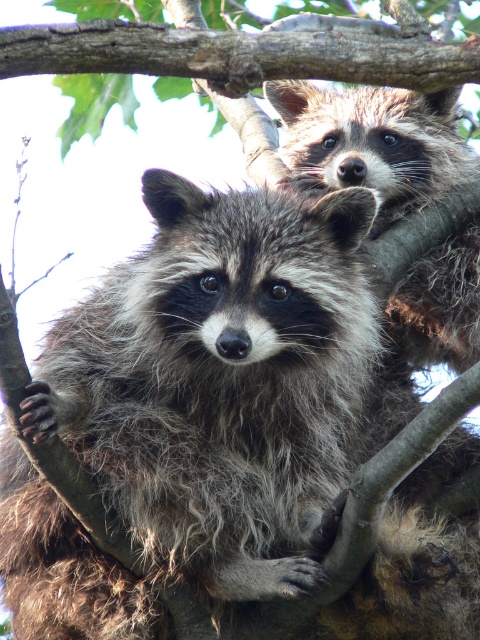
Between point (415, 275) and point (1, 58), which one is positioned in front?

Point (1, 58) is more forward.

This screenshot has height=640, width=480. What are the coordinates of `fuzzy brown raccoon at upper center` in the screenshot? It's located at (372, 141).